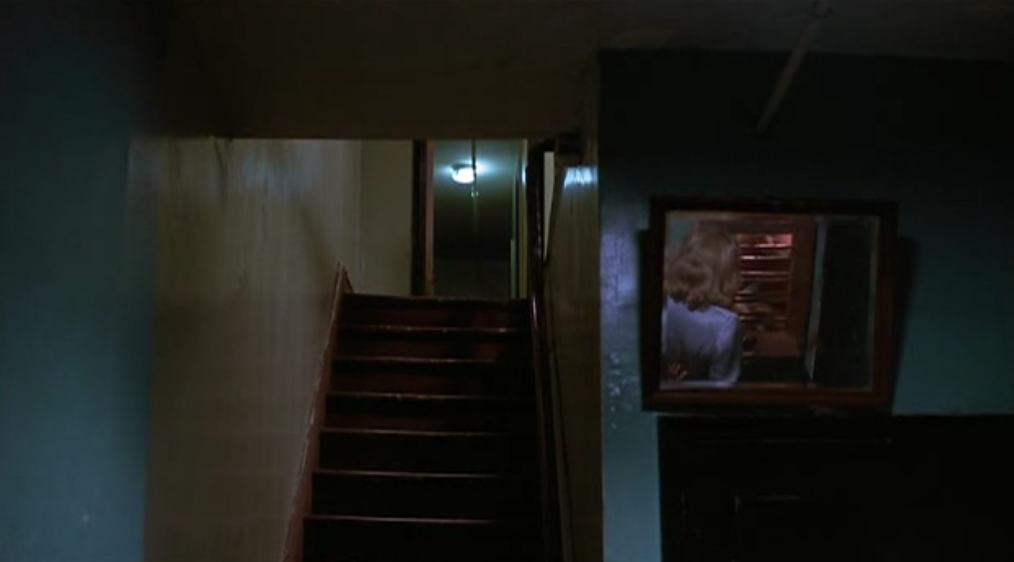
Identify the location of doorway. (424, 207).